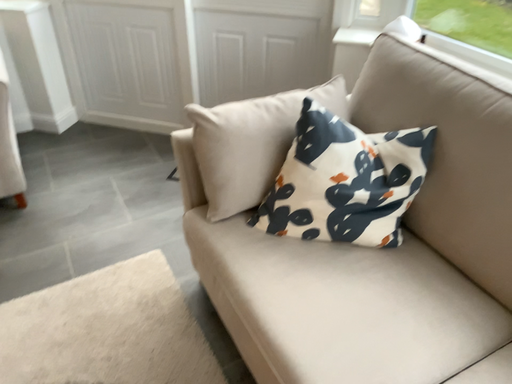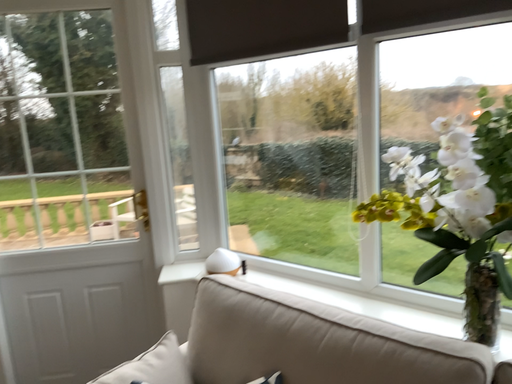
Question: Which way did the camera rotate in the video?

Choices:
 (A) rotated downward
 (B) rotated upward

Answer: (B)